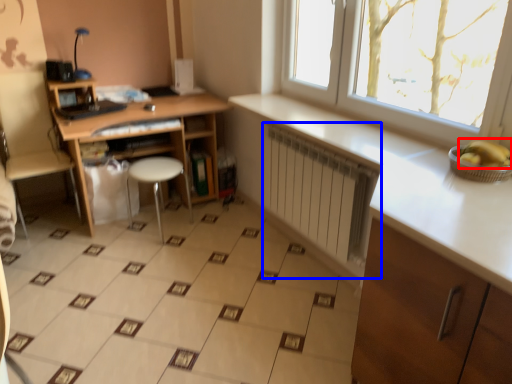
Question: Which point is further to the camera, banana (highlighted by a red box) or radiator (highlighted by a blue box)?

Choices:
 (A) banana
 (B) radiator

Answer: (B)